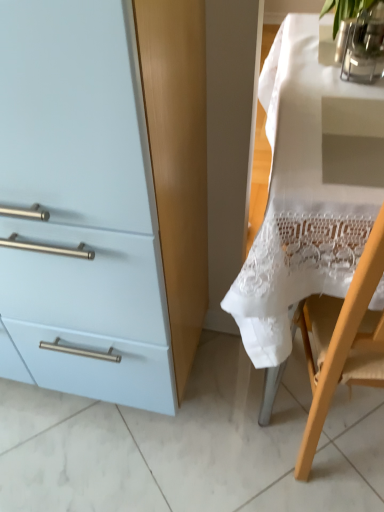
Find the location of a particular element. The width and height of the screenshot is (384, 512). vacant area that is in front of light blue matte cabinet at left is located at coordinates (83, 460).